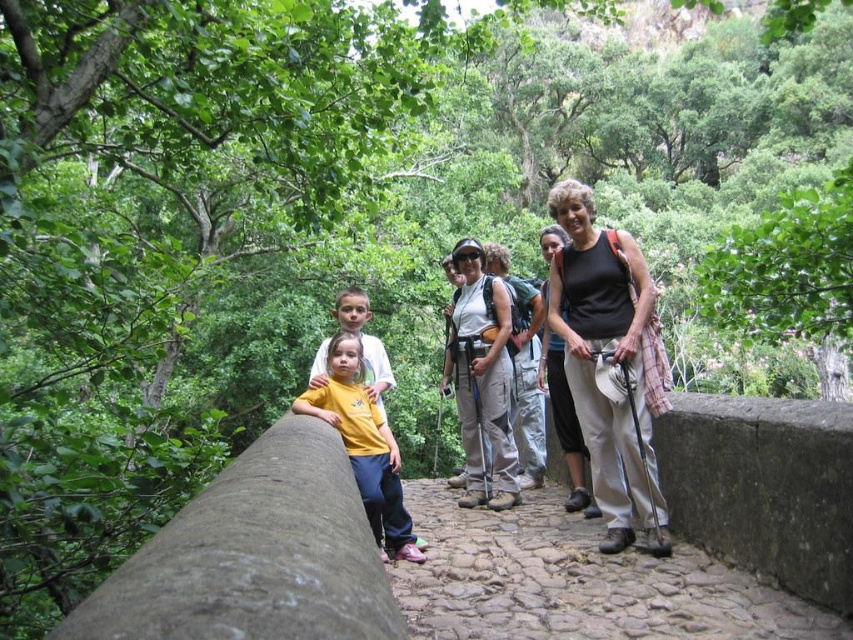
You are a photographer trying to capture both the matte black tank top at center and the yellow matte shirt at center in the same frame. Which clothing item appears bigger in the photo?

The matte black tank top at center appears bigger in the photo because it has a larger size compared to the yellow matte shirt at center.

You are a hiker standing on the cobblestone path at center and looking towards the yellow matte shirt at center. Which object is closer to you?

The cobblestone path at center is closer to you since it is in front of the yellow matte shirt at center.